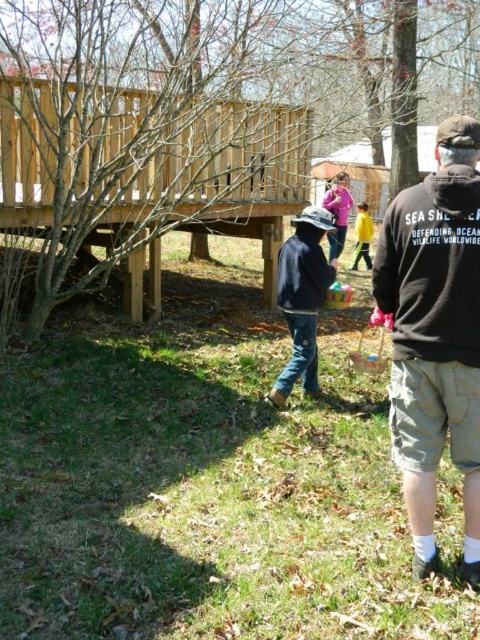
Is black cotton sweatshirt at right shorter than dark blue fleece sweatshirt at center?

No, black cotton sweatshirt at right is not shorter than dark blue fleece sweatshirt at center.

Between point (478, 532) and point (278, 278), which one is positioned in front?

Point (478, 532) is in front.

Who is more forward, (x=455, y=125) or (x=310, y=285)?

Point (x=455, y=125) is in front.

What are the coordinates of `black cotton sweatshirt at right` in the screenshot? It's located at (435, 336).

Is dark blue fleece sweatshirt at center wider than yellow matte jacket at center?

Incorrect, dark blue fleece sweatshirt at center's width does not surpass yellow matte jacket at center's.

Does dark blue fleece sweatshirt at center appear over yellow matte jacket at center?

Actually, dark blue fleece sweatshirt at center is below yellow matte jacket at center.

Which is in front, point (299, 280) or point (368, 225)?

Positioned in front is point (299, 280).

Locate an element on the screen. The image size is (480, 640). dark blue fleece sweatshirt at center is located at coordinates (302, 269).

Does denim jacket at center have a smaller size compared to yellow matte jacket at center?

Indeed, denim jacket at center has a smaller size compared to yellow matte jacket at center.

The width and height of the screenshot is (480, 640). I want to click on denim jacket at center, so click(302, 298).

Who is more distant from viewer, (298, 372) or (360, 228)?

The point (360, 228) is behind.

Identify the location of denim jacket at center. The image size is (480, 640). (302, 298).